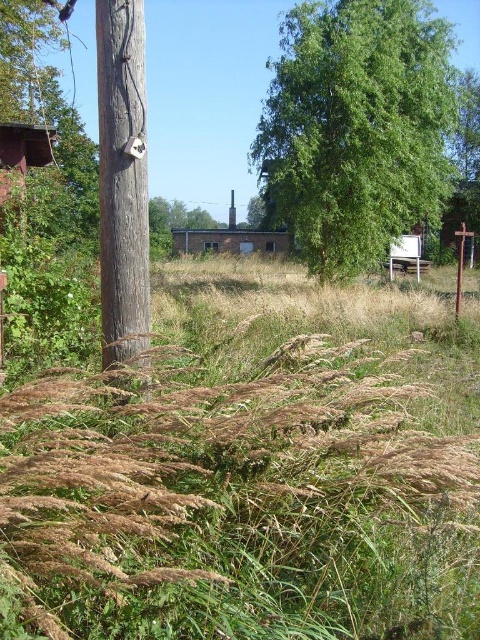
Who is positioned more to the left, green leafy tree at upper right or brown wooden post at left?

brown wooden post at left

Which is in front, point (420, 54) or point (141, 272)?

Point (141, 272)

The width and height of the screenshot is (480, 640). I want to click on green leafy tree at upper right, so click(357, 128).

Does brown dry grass at lower left have a lesser width compared to green leafy tree at upper right?

Indeed, brown dry grass at lower left has a lesser width compared to green leafy tree at upper right.

Looking at this image, does brown dry grass at lower left have a greater width compared to green leafy tree at upper right?

No.

The height and width of the screenshot is (640, 480). Describe the element at coordinates (252, 470) in the screenshot. I see `brown dry grass at lower left` at that location.

Identify the location of brown dry grass at lower left. (252, 470).

Is brown dry grass at lower left wider than brown wooden post at left?

Correct, the width of brown dry grass at lower left exceeds that of brown wooden post at left.

Does point (39, 460) come farther from viewer compared to point (106, 176)?

No, (39, 460) is closer to viewer.

Is point (226, 506) positioned after point (111, 172)?

That is False.

I want to click on brown dry grass at lower left, so click(x=252, y=470).